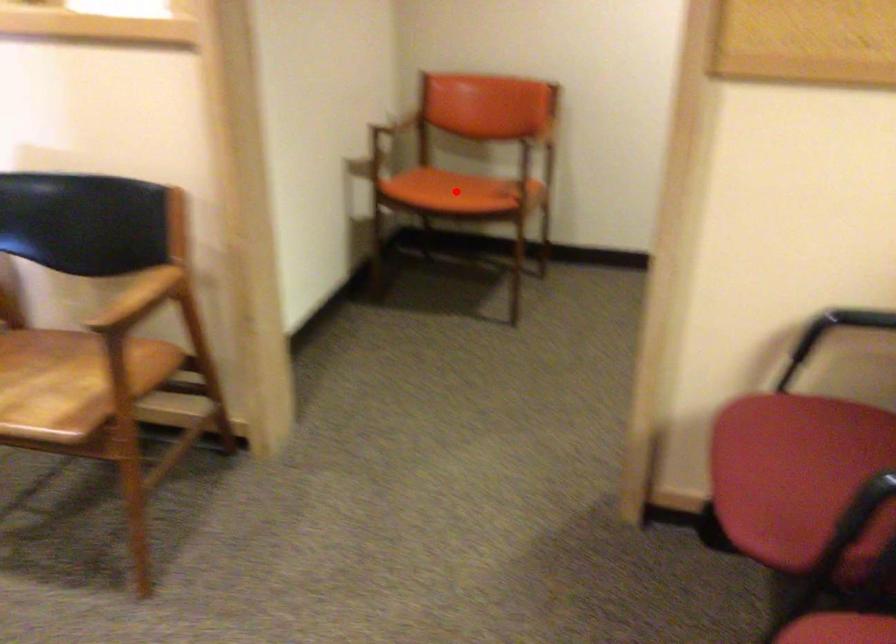
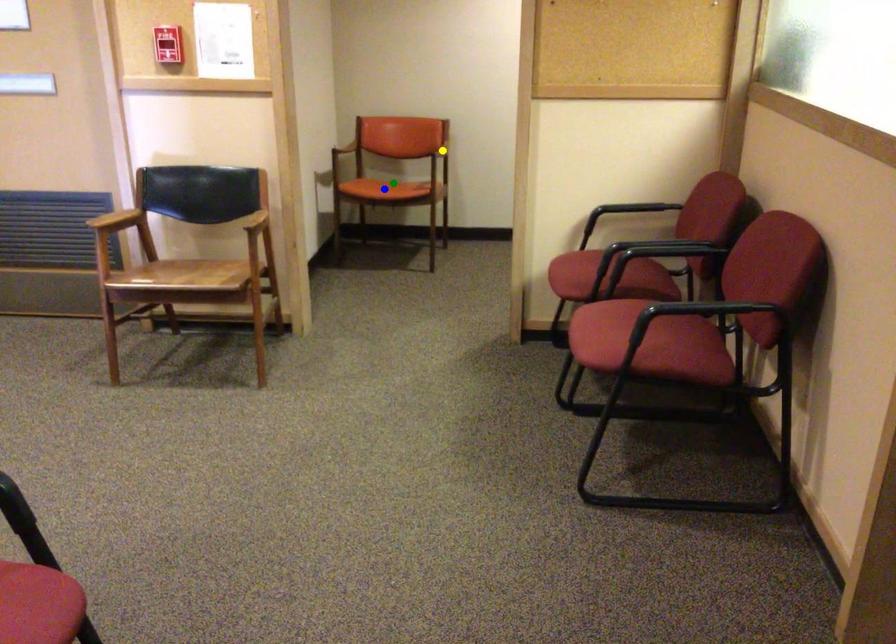
Question: I am providing you with two images of the same scene from different viewpoints. A red point is marked on the first image. You are given multiple points on the second image. Which point in image 2 represents the same 3d spot as the red point in image 1?

Choices:
 (A) green point
 (B) yellow point
 (C) blue point

Answer: (A)